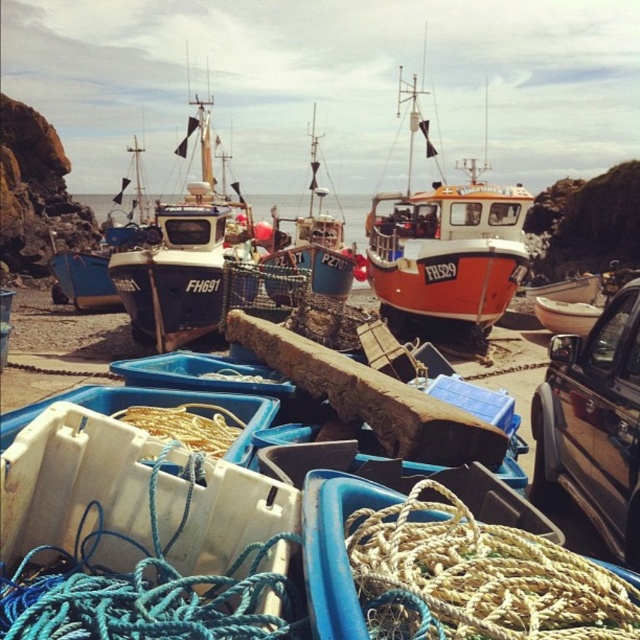
Which of these two, black glossy truck at right or white matte rope at center, stands shorter?

Standing shorter between the two is white matte rope at center.

Does black glossy truck at right have a larger size compared to white matte rope at center?

Yes, black glossy truck at right is bigger than white matte rope at center.

Image resolution: width=640 pixels, height=640 pixels. Identify the location of black glossy truck at right. (593, 426).

Can you confirm if orange matte boat at center is shorter than matte black boat at left?

No, orange matte boat at center is not shorter than matte black boat at left.

Does orange matte boat at center appear on the left side of matte black boat at left?

In fact, orange matte boat at center is to the right of matte black boat at left.

Identify the location of orange matte boat at center. (445, 243).

Between black glossy truck at right and matte black boat at left, which one appears on the left side from the viewer's perspective?

Positioned to the left is matte black boat at left.

Is the position of black glossy truck at right less distant than that of matte black boat at left?

Yes, it is.

Is point (557, 481) closer to camera compared to point (99, 264)?

That is True.

Locate an element on the screen. The height and width of the screenshot is (640, 640). black glossy truck at right is located at coordinates (593, 426).